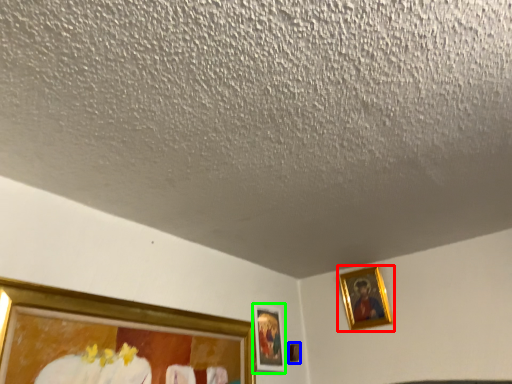
Question: Estimate the real-world distances between objects in this image. Which object is farther from picture frame (highlighted by a red box), picture frame (highlighted by a blue box) or picture frame (highlighted by a green box)?

Choices:
 (A) picture frame
 (B) picture frame

Answer: (B)